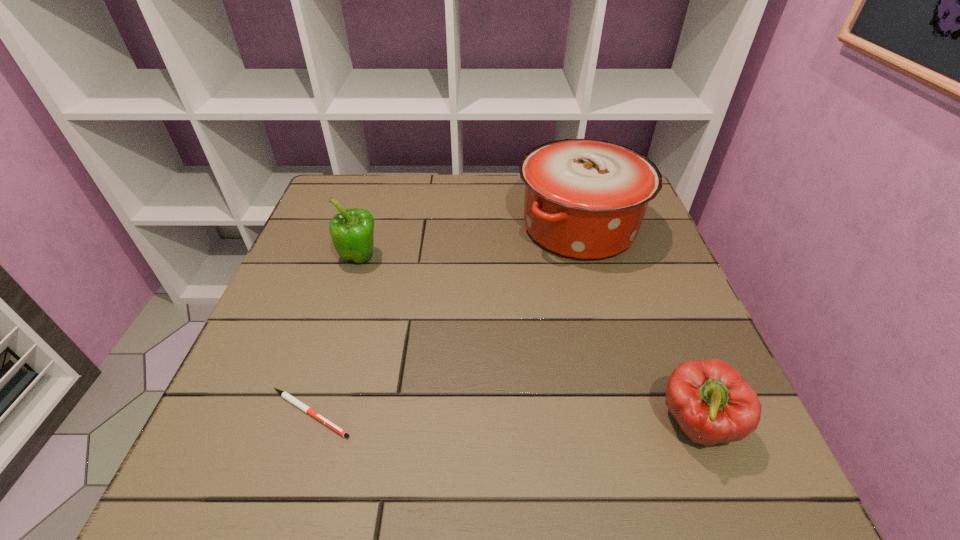
You are a GUI agent. You are given a task and a screenshot of the screen. Output one action in this format:
    pyautogui.click(x=<x>, y=<y>)
    Task: Click on the free space at the left edge of the desktop
    This screenshot has width=960, height=540.
    Given the screenshot: What is the action you would take?
    pyautogui.click(x=282, y=366)

In the image, there is a desktop. Find the location of `vacant region at the right edge`. vacant region at the right edge is located at coordinates (671, 286).

The width and height of the screenshot is (960, 540). I want to click on blank space at the far left corner of the desktop, so click(x=380, y=185).

This screenshot has width=960, height=540. I want to click on vacant space at the near right corner, so (768, 500).

Locate an element on the screen. The height and width of the screenshot is (540, 960). unoccupied position between the taller bell pepper and the pen is located at coordinates (335, 336).

At what (x,y) coordinates should I click in order to perform the action: click on free space between the pen and the casserole. Please return your answer as a coordinate pair (x, y). Looking at the image, I should click on 444,320.

Image resolution: width=960 pixels, height=540 pixels. In order to click on unoccupied area between the tallest object and the right bell pepper in this screenshot , I will do pyautogui.click(x=637, y=326).

The height and width of the screenshot is (540, 960). Identify the location of free space between the tallest object and the nearer bell pepper. (637, 326).

Identify the location of free space between the taller bell pepper and the casserole. This screenshot has height=540, width=960. click(x=469, y=243).

The width and height of the screenshot is (960, 540). What are the coordinates of `vacant area that lies between the left bell pepper and the shortest object` in the screenshot? It's located at (335, 336).